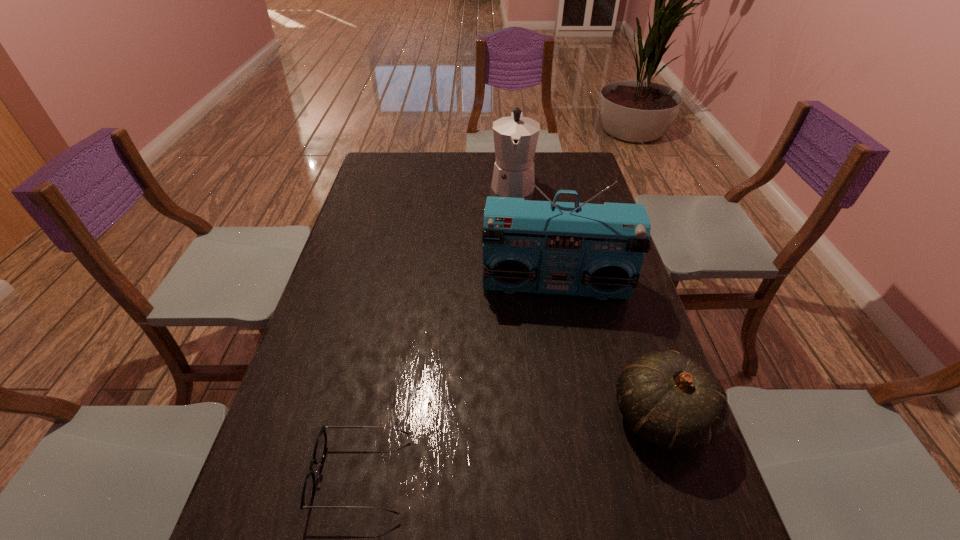
Locate an element on the screen. This screenshot has height=540, width=960. vacant space at the near edge of the desktop is located at coordinates pyautogui.click(x=419, y=491).

Find the location of a particular element. Image resolution: width=960 pixels, height=540 pixels. free region at the left edge of the desktop is located at coordinates (310, 345).

Locate an element on the screen. blank area at the far right corner is located at coordinates (548, 152).

Find the location of `vacant point located between the second farthest object and the shortest object`. vacant point located between the second farthest object and the shortest object is located at coordinates tap(458, 380).

Where is `free space between the spectacles and the third shortest object`? The width and height of the screenshot is (960, 540). free space between the spectacles and the third shortest object is located at coordinates (437, 329).

You are a GUI agent. You are given a task and a screenshot of the screen. Output one action in this format:
    pyautogui.click(x=<x>, y=<y>)
    Task: Click on the empty location between the gourd and the third nearest object
    
    Given the screenshot: What is the action you would take?
    pyautogui.click(x=608, y=352)

The image size is (960, 540). In order to click on vacant point located between the radio receiver and the gourd in this screenshot , I will do `click(608, 352)`.

Where is `the third closest object to the third nearest object`? The height and width of the screenshot is (540, 960). the third closest object to the third nearest object is located at coordinates (308, 491).

Locate which object ranks second in proximity to the second shortest object. Please provide its 2D coordinates. Your answer should be formatted as a tuple, i.e. [(x, y)], where the tuple contains the x and y coordinates of a point satisfying the conditions above.

[(308, 491)]

I want to click on free point that satisfies the following two spatial constraints: 1. on the front side of the third tallest object; 2. on the left side of the radio receiver, so click(578, 418).